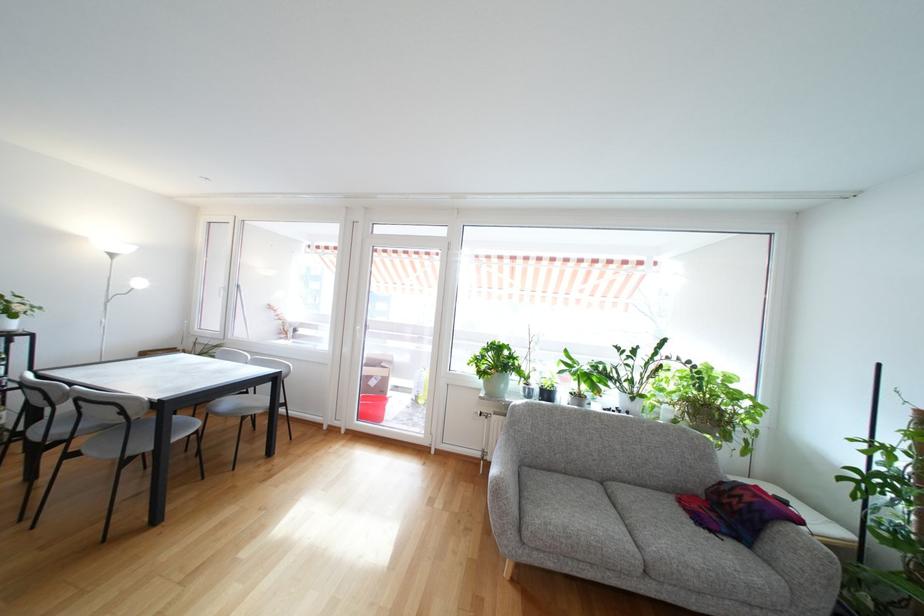
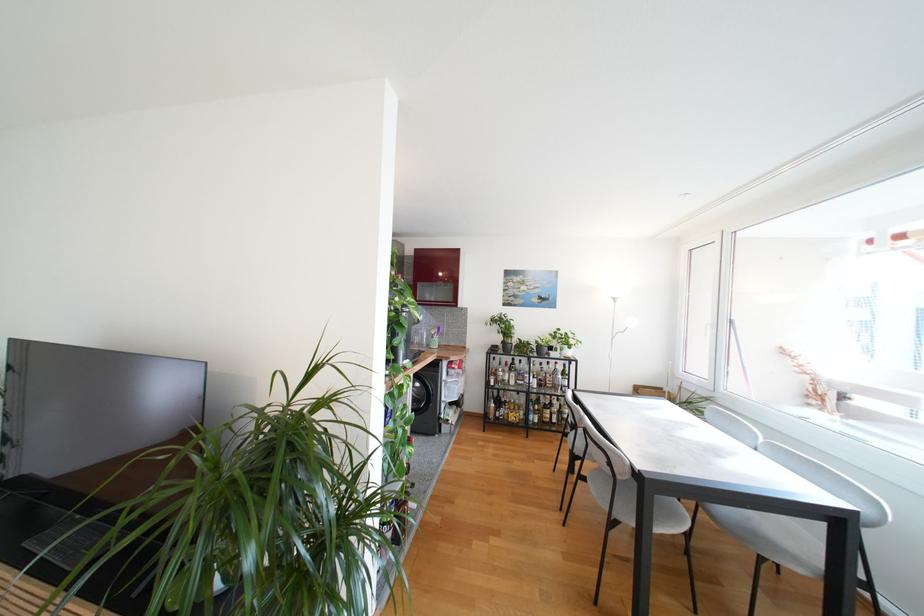
Question: The camera is either moving clockwise (left) or counter-clockwise (right) around the object. The first image is from the beginning of the video and the second image is from the end. Is the camera moving left or right when shooting the video?

Choices:
 (A) Left
 (B) Right

Answer: (B)